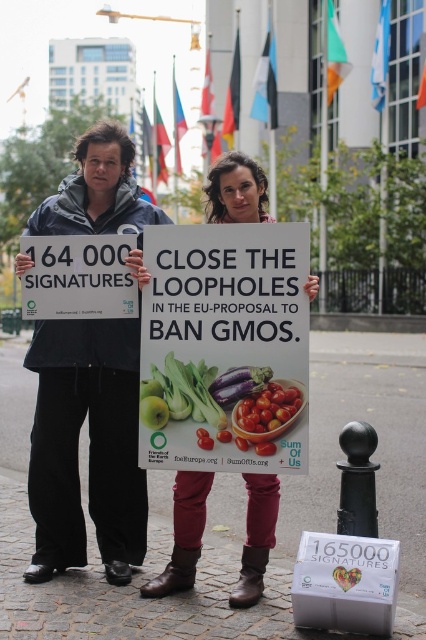
Question: Is matte black jacket at center positioned behind green matte apple at center?

Choices:
 (A) yes
 (B) no

Answer: (A)

Question: Is matte plastic sign at center to the left of shiny red tomatoes at center from the viewer's perspective?

Choices:
 (A) no
 (B) yes

Answer: (B)

Question: Among these objects, which one is nearest to the camera?

Choices:
 (A) matte purple eggplant at center
 (B) matte plastic sign at center
 (C) green matte vegetables at center

Answer: (B)

Question: Which of the following is the closest to the observer?

Choices:
 (A) (302, 397)
 (B) (302, 403)
 (C) (75, 209)
 (D) (270, 374)

Answer: (A)

Question: Which object is the closest to the matte purple eggplant at center?

Choices:
 (A) green matte apple at center
 (B) shiny red tomatoes at center

Answer: (B)

Question: Is shiny red tomatoes at center bigger than green matte apple at center?

Choices:
 (A) yes
 (B) no

Answer: (A)